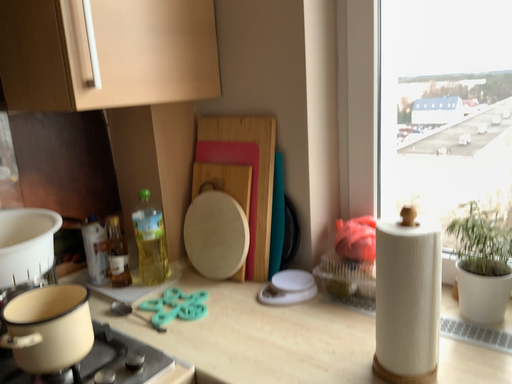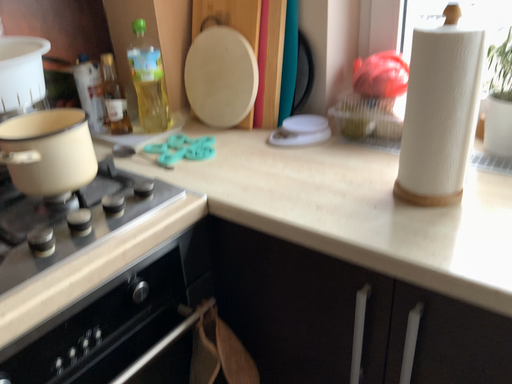
Question: Which way did the camera rotate in the video?

Choices:
 (A) rotated downward
 (B) rotated upward

Answer: (A)